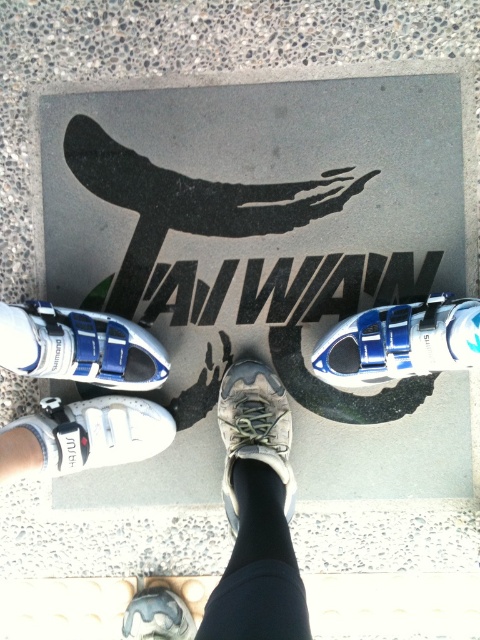
Which is behind, point (56, 308) or point (365, 365)?

The point (56, 308) is more distant.

The height and width of the screenshot is (640, 480). What are the coordinates of `white synthetic shoe at left` in the screenshot? It's located at (80, 348).

Is point (168, 365) less distant than point (360, 316)?

No, it is behind (360, 316).

Where is `white synthetic shoe at left`? This screenshot has height=640, width=480. white synthetic shoe at left is located at coordinates (80, 348).

Who is positioned more to the right, white synthetic shoe at lower left or gray rubber shoe at center?

Positioned to the right is gray rubber shoe at center.

Is white synthetic shoe at lower left above gray rubber shoe at center?

Correct, white synthetic shoe at lower left is located above gray rubber shoe at center.

Is point (84, 401) more distant than point (162, 611)?

Yes.

In order to click on white synthetic shoe at lower left in this screenshot , I will do coord(84,435).

Which is behind, point (83, 380) or point (131, 628)?

The point (83, 380) is more distant.

Is white synthetic shoe at left thinner than gray rubber shoe at center?

Incorrect, white synthetic shoe at left's width is not less than gray rubber shoe at center's.

Is point (136, 369) more distant than point (152, 604)?

Yes, point (136, 369) is behind point (152, 604).

I want to click on white synthetic shoe at left, so click(80, 348).